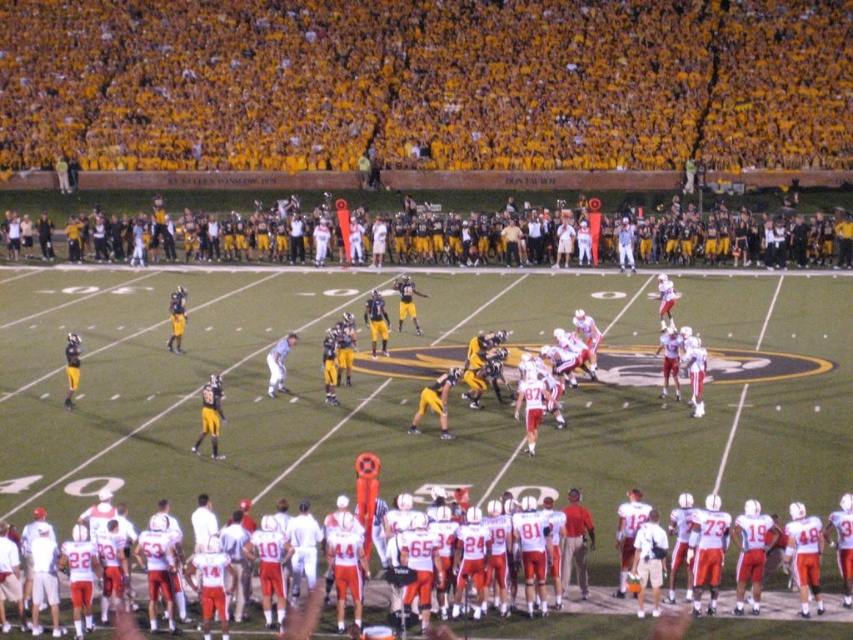
Is point (62, 10) more distant than point (724, 598)?

Yes.

Which is above, yellow/yellowish fabric at upper center or white matte uniform at center?

Positioned higher is yellow/yellowish fabric at upper center.

Looking at this image, who is more distant from viewer, (570,152) or (585,636)?

Point (570,152)

At what (x,y) coordinates should I click in order to perform the action: click on yellow/yellowish fabric at upper center. Please return your answer as a coordinate pair (x, y). Looking at the image, I should click on (425, 83).